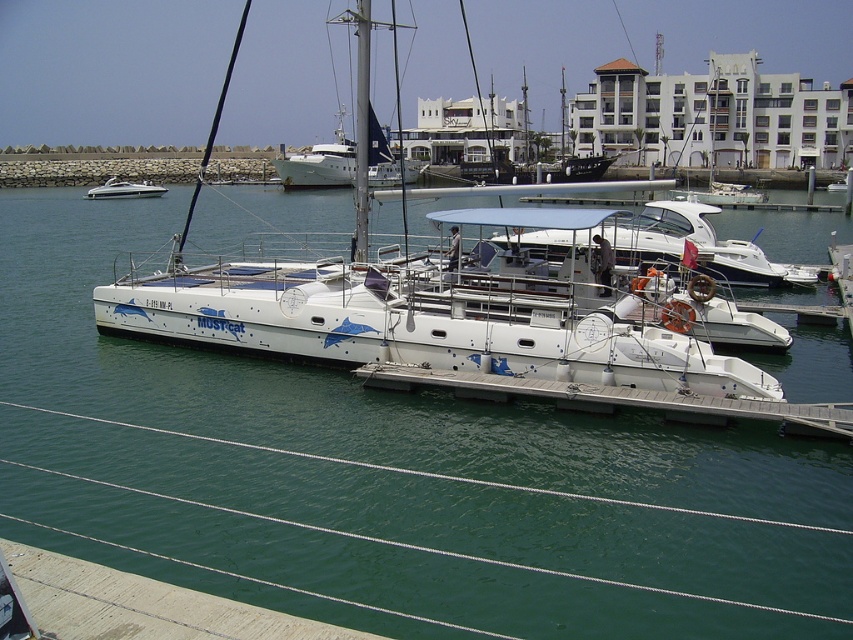
You are planning to transport a large cargo container that requires a vessel with a minimum width of 12 meters. You observe the white glossy catamaran at center and the white glossy speedboat at left in the marina. Which vessel, if either, can accommodate the cargo container based on their widths?

The white glossy speedboat at left has a greater width than the white glossy catamaran at center. Since the catamaran at center is narrower, neither vessel may meet the 12 meter requirement unless the speedboat exceeds that width. However based on the given information only that the catamaran is narrower than the speedboat, we cannot definitively determine if either meets the 12m standard.

You are a photographer planning to capture the white glossy catamaran at center and the white glossy speedboat at left from a position behind the marina pier. Which vessel will appear shorter in your photo?

The white glossy catamaran at center will appear shorter in the photo because it is not as tall as the white glossy speedboat at left.

You are a dock inspector checking the marina. You need to ensure that the white concrete dock at lower center can support the weight of the white glossy catamaran at center. Given that the dock can only handle items narrower than itself, can the catamaran safely dock here?

The white concrete dock at lower center has a lesser width compared to the white glossy catamaran at center. Since the dock is narrower than the catamaran, it cannot safely support the catamaran as it is wider than the dock.